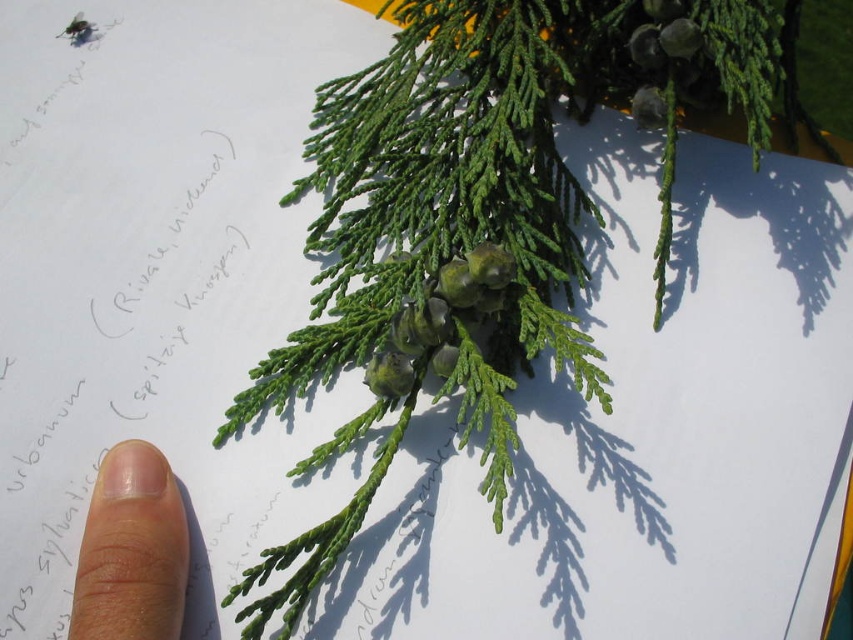
How far apart are green textured branch at center and flesh-toned skin at lower left?

green textured branch at center is 43.06 centimeters from flesh-toned skin at lower left.

Who is more distant from viewer, (389, 228) or (115, 612)?

Positioned behind is point (389, 228).

Where is `green textured branch at center`? Image resolution: width=853 pixels, height=640 pixels. green textured branch at center is located at coordinates (434, 243).